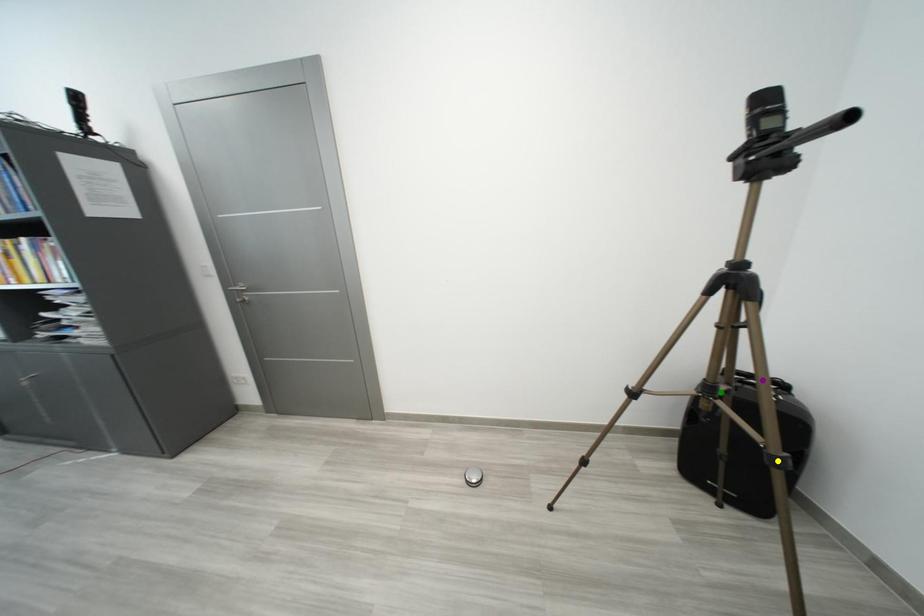
Order these from nearest to farthest:
yellow point, green point, purple point

yellow point < green point < purple point